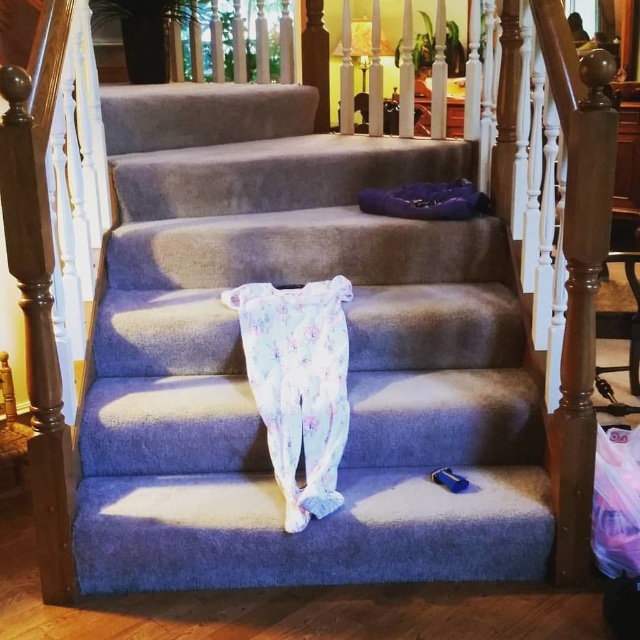
Question: Which point appears closest to the camera in this image?

Choices:
 (A) (468, 202)
 (B) (305, 340)

Answer: (B)

Question: Is fluffy cotton leggings at center wider than purple soft pillow at upper center?

Choices:
 (A) no
 (B) yes

Answer: (A)

Question: Does fluffy cotton leggings at center have a smaller size compared to purple soft pillow at upper center?

Choices:
 (A) no
 (B) yes

Answer: (A)

Question: Which object appears closest to the camera in this image?

Choices:
 (A) purple soft pillow at upper center
 (B) fluffy cotton leggings at center
 (C) blue carpet at center

Answer: (B)

Question: Which is farther from the fluffy cotton leggings at center?

Choices:
 (A) blue carpet at center
 (B) purple soft pillow at upper center

Answer: (B)

Question: Is the position of blue carpet at center more distant than that of fluffy cotton leggings at center?

Choices:
 (A) yes
 (B) no

Answer: (A)